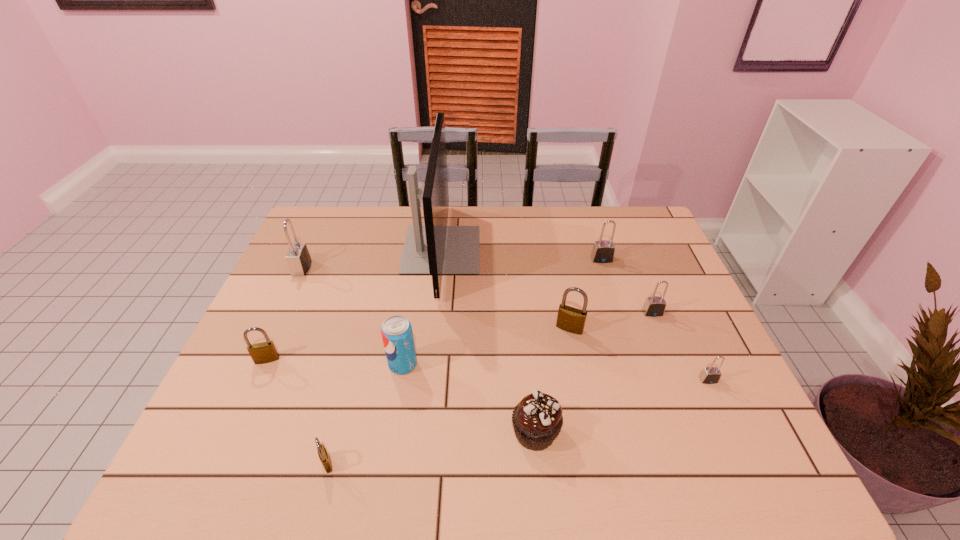
I want to click on gray padlock that stands as the fourth closest to the soda can, so click(x=710, y=375).

Where is `gray padlock object that ranks as the closest to the seventh nearest object`? The width and height of the screenshot is (960, 540). gray padlock object that ranks as the closest to the seventh nearest object is located at coordinates (710, 375).

Where is `brass padlock identified as the second closest to the biggest brass padlock`? brass padlock identified as the second closest to the biggest brass padlock is located at coordinates (265, 352).

Choose which brass padlock is the second nearest neighbor to the nearest brass padlock. Please provide its 2D coordinates. Your answer should be formatted as a tuple, i.e. [(x, y)], where the tuple contains the x and y coordinates of a point satisfying the conditions above.

[(570, 319)]

In order to click on vacant space that satisfies the following two spatial constraints: 1. on the shackle of the biggest gray padlock; 2. on the left side of the fourth nearest padlock in this screenshot , I will do `click(275, 328)`.

Where is `free point that satisfies the following two spatial constraints: 1. on the screen of the tallest object; 2. on the front side of the soda can`? The image size is (960, 540). free point that satisfies the following two spatial constraints: 1. on the screen of the tallest object; 2. on the front side of the soda can is located at coordinates (430, 364).

I want to click on free region that satisfies the following two spatial constraints: 1. on the screen of the tallest object; 2. on the right side of the fifth object from right to left, so click(x=422, y=432).

Locate an element on the screen. The image size is (960, 540). vacant space that satisfies the following two spatial constraints: 1. on the shackle of the ninth shortest object; 2. on the back side of the brown cupcake is located at coordinates (227, 432).